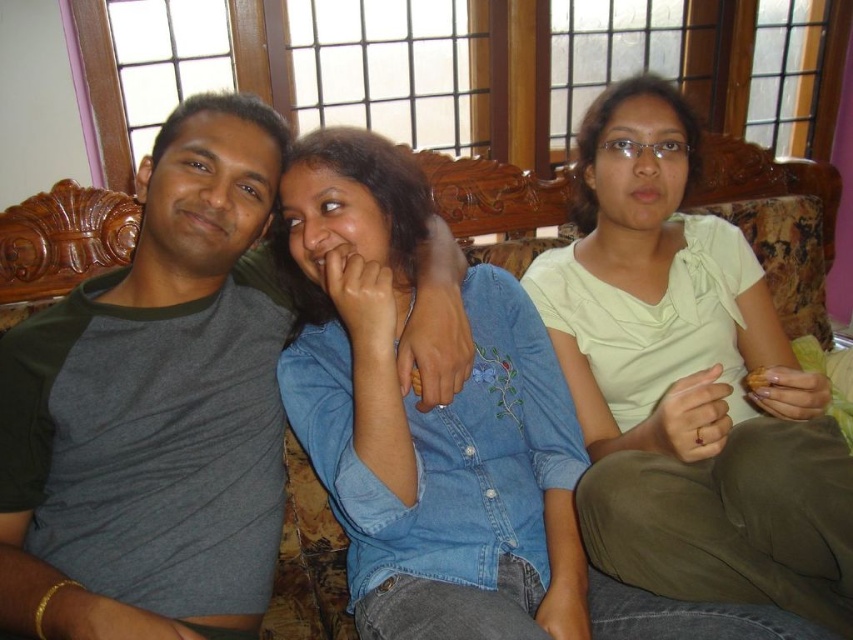
Is gray cotton t-shirt at left wider than denim shirt at center?

No.

Based on the photo, who is more distant from viewer, (x=190, y=404) or (x=538, y=616)?

The point (x=190, y=404) is more distant.

Measure the distance between gray cotton t-shirt at left and camera.

A distance of 33.11 inches exists between gray cotton t-shirt at left and camera.

The image size is (853, 640). Find the location of `gray cotton t-shirt at left`. gray cotton t-shirt at left is located at coordinates (154, 410).

Which is below, light green fabric shirt at center or denim shirt at center?

denim shirt at center is lower down.

Which is more to the right, light green fabric shirt at center or denim shirt at center?

light green fabric shirt at center

At what (x,y) coordinates should I click in order to perform the action: click on light green fabric shirt at center. Please return your answer as a coordinate pair (x, y). Looking at the image, I should click on click(x=688, y=381).

Who is taller, gray cotton t-shirt at left or light green fabric shirt at center?

light green fabric shirt at center

Does gray cotton t-shirt at left have a smaller size compared to light green fabric shirt at center?

Correct, gray cotton t-shirt at left occupies less space than light green fabric shirt at center.

Does point (142, 624) come farther from viewer compared to point (671, 445)?

No, (142, 624) is in front of (671, 445).

Where is `gray cotton t-shirt at left`? Image resolution: width=853 pixels, height=640 pixels. gray cotton t-shirt at left is located at coordinates (154, 410).